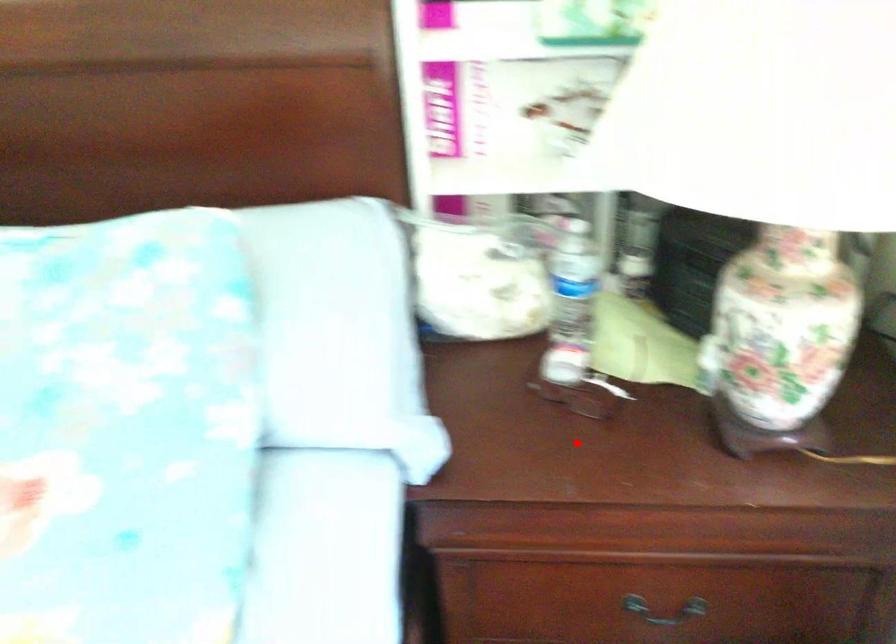
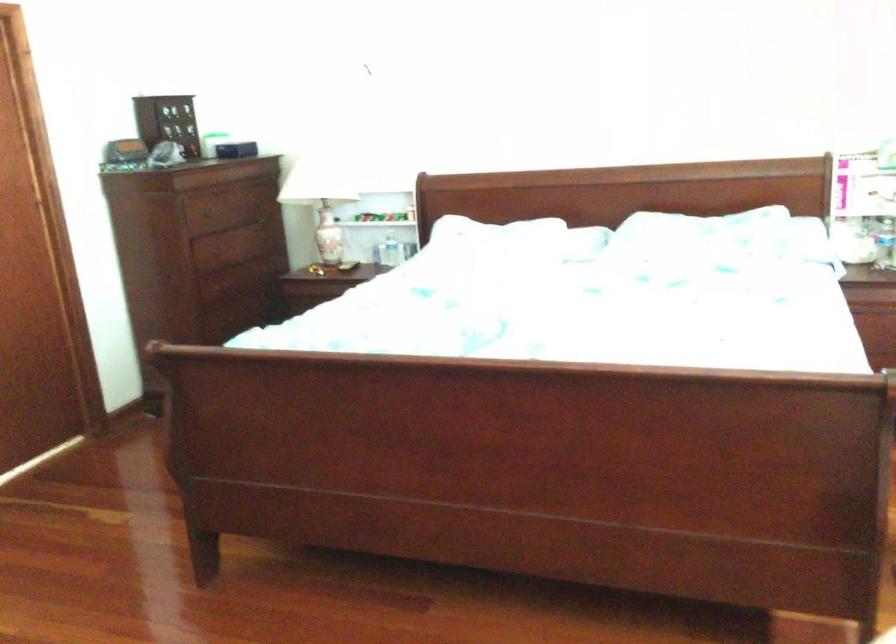
Question: A red point is marked in image1. In image2, is the corresponding 3D point closer to the camera or farther? Reply with the corresponding letter.

Choices:
 (A) The corresponding 3D point is closer.
 (B) The corresponding 3D point is farther.

Answer: (B)